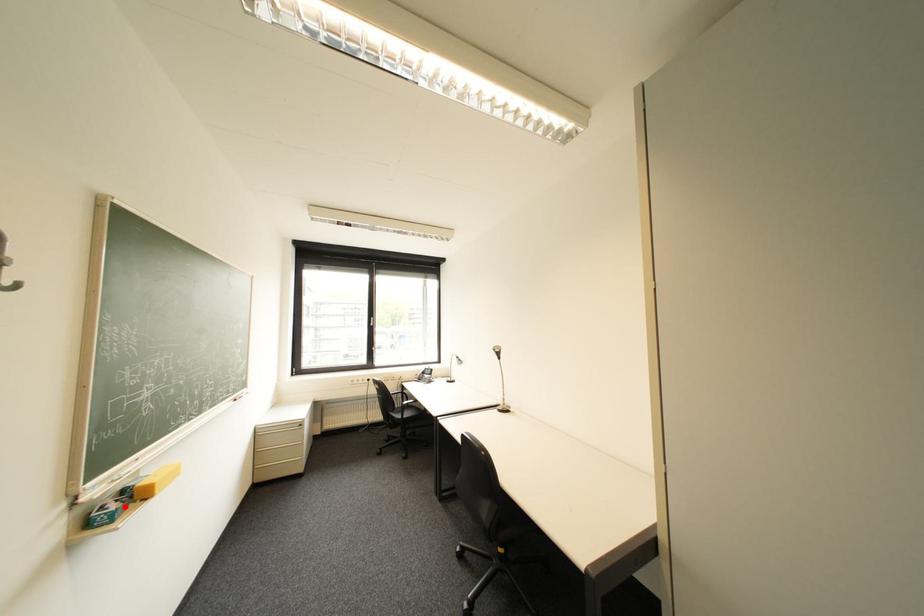
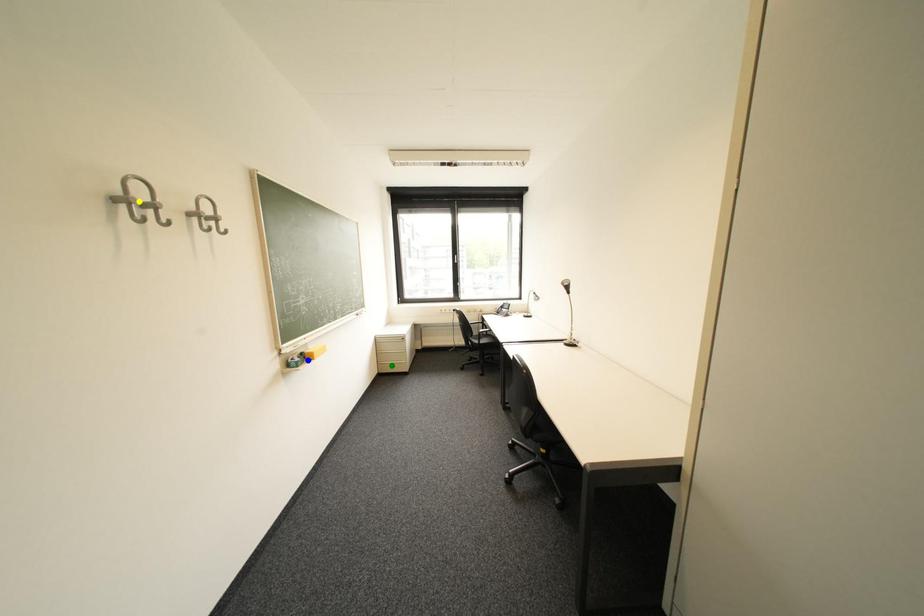
Question: I am providing you with two images of the same scene from different viewpoints. A red point is marked on the first image. You are given multiple points on the second image. Which mark in image 2 goes with the point in image 1?

Choices:
 (A) yellow point
 (B) blue point
 (C) green point

Answer: (B)